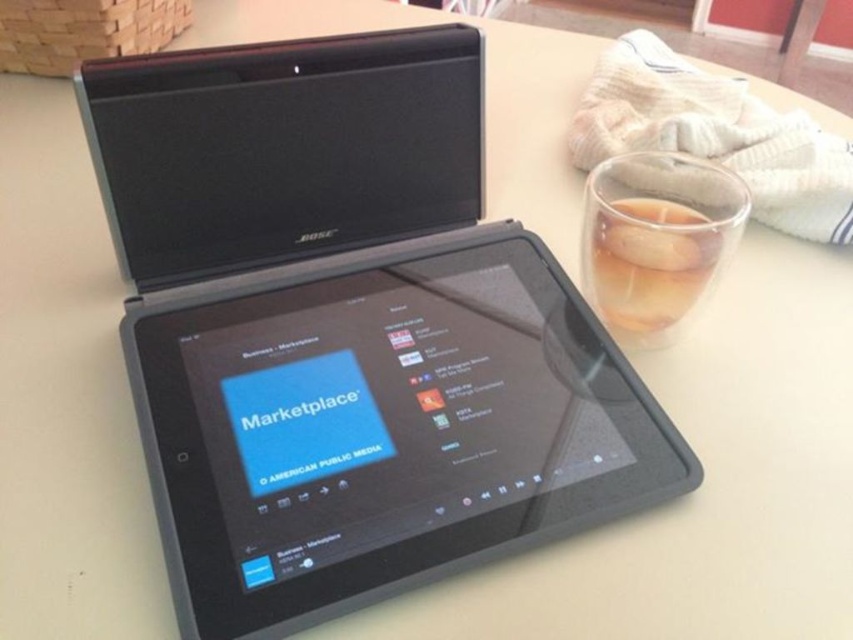
Which is more to the left, black matte tablet at center or translucent glass cup at right?

From the viewer's perspective, black matte tablet at center appears more on the left side.

Can you confirm if black matte tablet at center is positioned to the right of translucent glass cup at right?

Incorrect, black matte tablet at center is not on the right side of translucent glass cup at right.

Which is behind, point (293, 448) or point (718, 252)?

Positioned behind is point (718, 252).

At what (x,y) coordinates should I click in order to perform the action: click on black matte tablet at center. Please return your answer as a coordinate pair (x, y). Looking at the image, I should click on click(x=381, y=426).